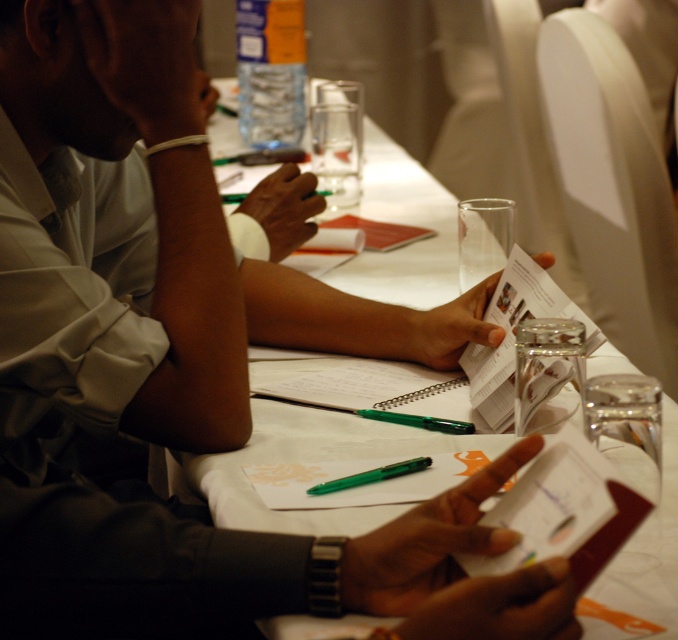
You are standing at the table and want to reach both the point at (306, 444) and the point at (418, 460). Which point is closer to you?

Point (418, 460) is closer to you because it is in front of point (306, 444).

You are organizing a meeting and need to place a 40 inch long banner between the white paper at center and the green plastic pen at center on the table. Can the banner fit between them without overlapping either object?

The white paper at center and green plastic pen at center are 39.07 inches apart from each other. Since the banner is 40 inches long, it cannot fit between them without overlapping either object because the distance between them is shorter than the banner length.